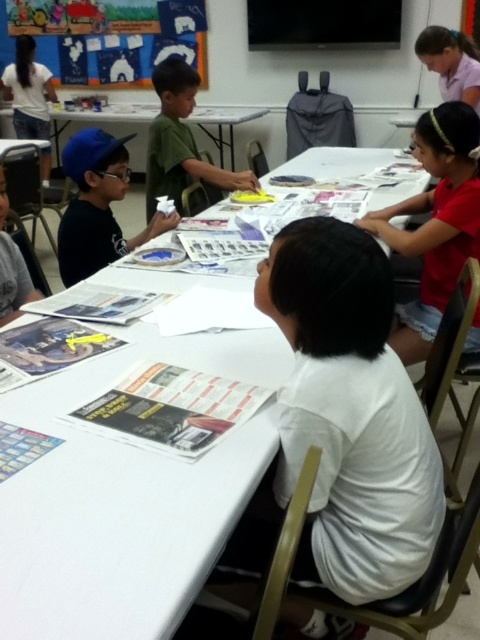
Question: Does white matte shirt at upper right appear on the left side of matte blue cap at left?

Choices:
 (A) yes
 (B) no

Answer: (B)

Question: Estimate the real-world distances between objects in this image. Which object is closer to the white paper at center?

Choices:
 (A) matte blue cap at left
 (B) white matte shirt at upper right
 (C) green matte shirt at center

Answer: (B)

Question: Estimate the real-world distances between objects in this image. Which object is farther from the white matte shirt at upper right?

Choices:
 (A) white paper at center
 (B) green matte shirt at center

Answer: (B)

Question: Which is farther from the white matte shirt at upper right?

Choices:
 (A) green matte shirt at center
 (B) white paper at center

Answer: (A)

Question: Can you confirm if white paper at center is smaller than matte blue cap at left?

Choices:
 (A) no
 (B) yes

Answer: (A)

Question: Considering the relative positions of white paper at center and white matte shirt at upper right in the image provided, where is white paper at center located with respect to white matte shirt at upper right?

Choices:
 (A) below
 (B) above

Answer: (A)